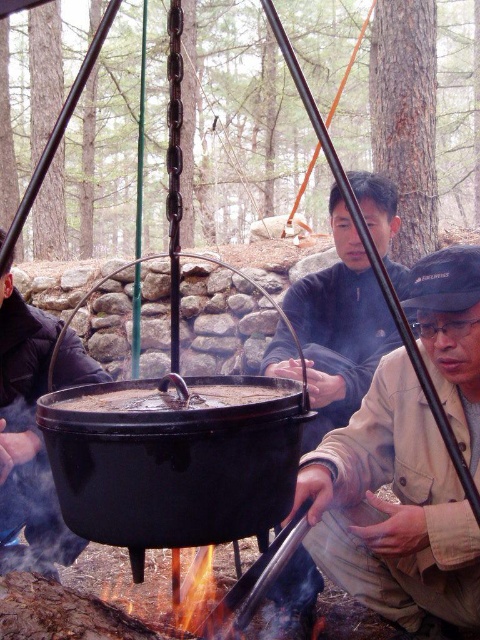
Question: Considering the relative positions of brown fabric jacket at lower right and dark blue jacket at center in the image provided, where is brown fabric jacket at lower right located with respect to dark blue jacket at center?

Choices:
 (A) right
 (B) left

Answer: (B)

Question: Is dark blue jacket at center wider than matte black jacket at center?

Choices:
 (A) no
 (B) yes

Answer: (B)

Question: Which of these objects is positioned closest to the brown fabric jacket at lower right?

Choices:
 (A) matte black jacket at center
 (B) dark blue jacket at center
 (C) black matte pot at center

Answer: (C)

Question: Estimate the real-world distances between objects in this image. Which object is farther from the dark blue jacket at center?

Choices:
 (A) black matte pot at center
 (B) matte black jacket at center

Answer: (B)

Question: Which object is closer to the camera taking this photo?

Choices:
 (A) brown fabric jacket at lower right
 (B) black matte pot at center
 (C) dark blue jacket at center
 (D) matte black jacket at center

Answer: (B)

Question: Does brown fabric jacket at lower right have a greater width compared to dark blue jacket at center?

Choices:
 (A) yes
 (B) no

Answer: (B)